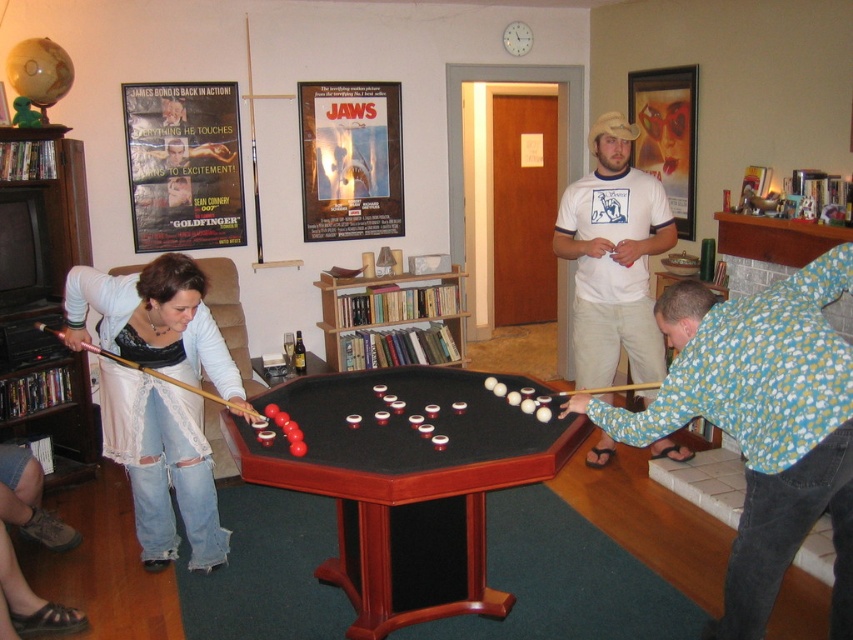
Question: Can you confirm if mahogany wood billiard table at center is thinner than matte white shirt at left?

Choices:
 (A) yes
 (B) no

Answer: (B)

Question: Which of the following is the farthest from the observer?

Choices:
 (A) (392, 428)
 (B) (183, 381)

Answer: (B)

Question: Can you confirm if white t-shirt at center is positioned below wooden cue at left?

Choices:
 (A) yes
 (B) no

Answer: (B)

Question: Among these objects, which one is nearest to the camera?

Choices:
 (A) wooden cue at left
 (B) floral shirt at center
 (C) matte white shirt at left
 (D) mahogany wood billiard table at center

Answer: (B)

Question: Is mahogany wood billiard table at center wider than wooden cue at center?

Choices:
 (A) no
 (B) yes

Answer: (B)

Question: Estimate the real-world distances between objects in this image. Which object is closer to the wooden cue at center?

Choices:
 (A) floral shirt at center
 (B) mahogany wood billiard table at center
 (C) wooden cue at left
 (D) matte white shirt at left

Answer: (A)